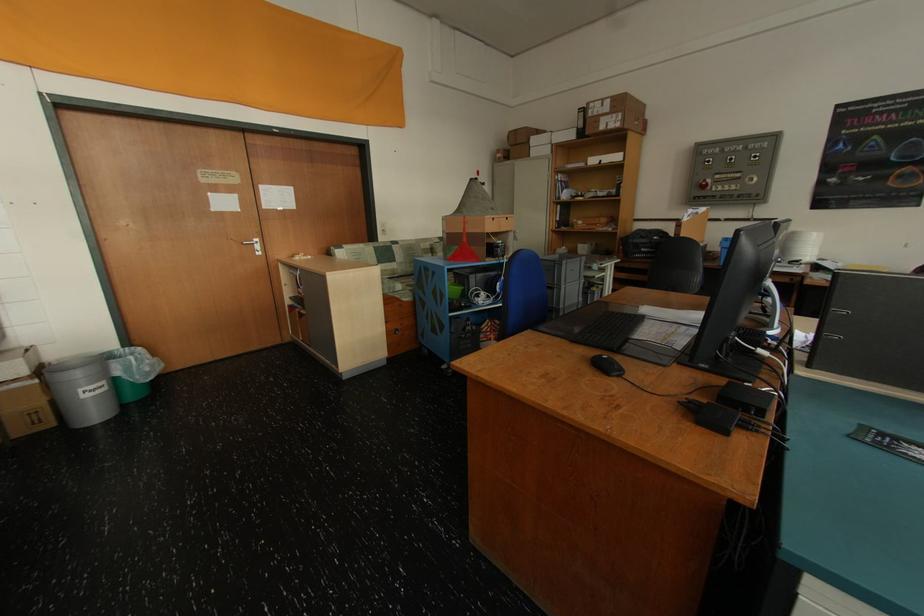
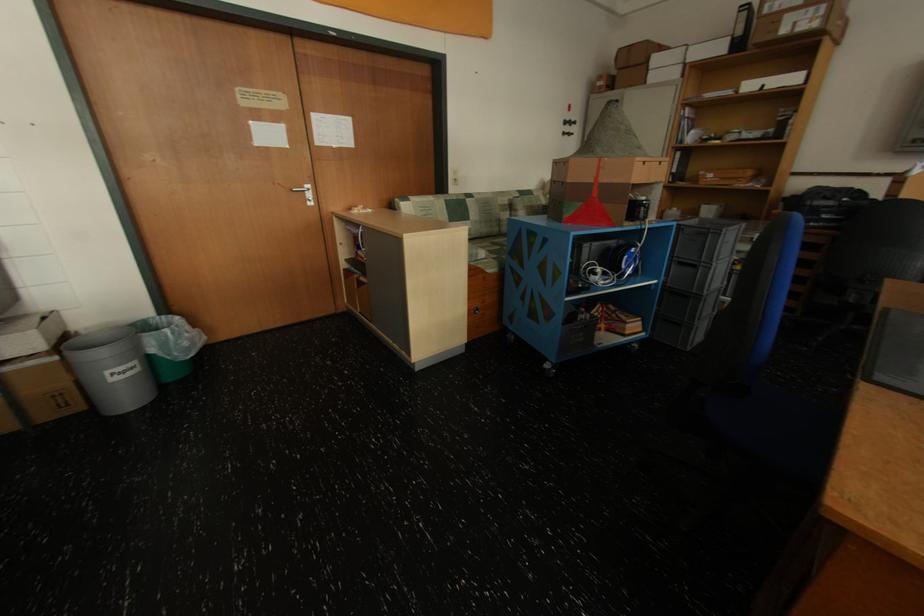
The point at (x=380, y=237) is marked in the first image. Where is the corresponding point in the second image?

(448, 187)